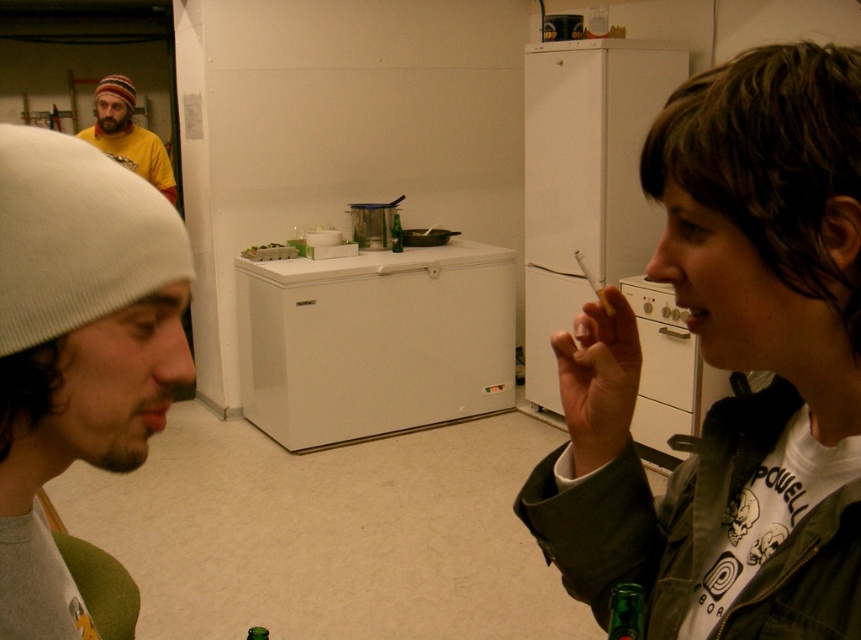
You are trying to locate the green matte jacket at right in the kitchen scene. According to the image, where is it positioned relative to the white matte refrigerator at upper center?

The green matte jacket at right is positioned below the white matte refrigerator at upper center.

You are trying to place a new kitchen appliance between the green matte jacket at right and the white matte refrigerator at upper center. Based on their positions, which object should you position the appliance closer to in order to center it between them?

The green matte jacket at right is to the left of the white matte refrigerator at upper center, so to center the appliance between them, place it closer to the green matte jacket at right since it is positioned to the left of the refrigerator.

You are a photographer adjusting your camera to focus on two points in the scene. The first point is labeled as point (104, 122) and the second is point (394, 246). Which point should you focus on first if you want to capture the nearest object in the scene?

Point (104, 122) is closer to the camera than point (394, 246), so you should focus on point (104, 122) first to capture the nearest object in the scene.